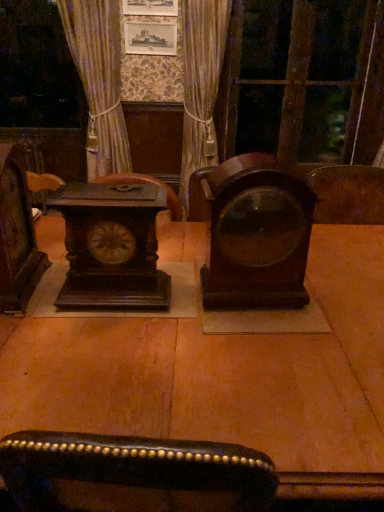
You are a GUI agent. You are given a task and a screenshot of the screen. Output one action in this format:
    pyautogui.click(x=<x>, y=<y>)
    Task: Click on the free space to the left of dark brown wood clock at left, the 2th alarm clock in the right-to-left sequence
    The height and width of the screenshot is (512, 384).
    Given the screenshot: What is the action you would take?
    pyautogui.click(x=44, y=303)